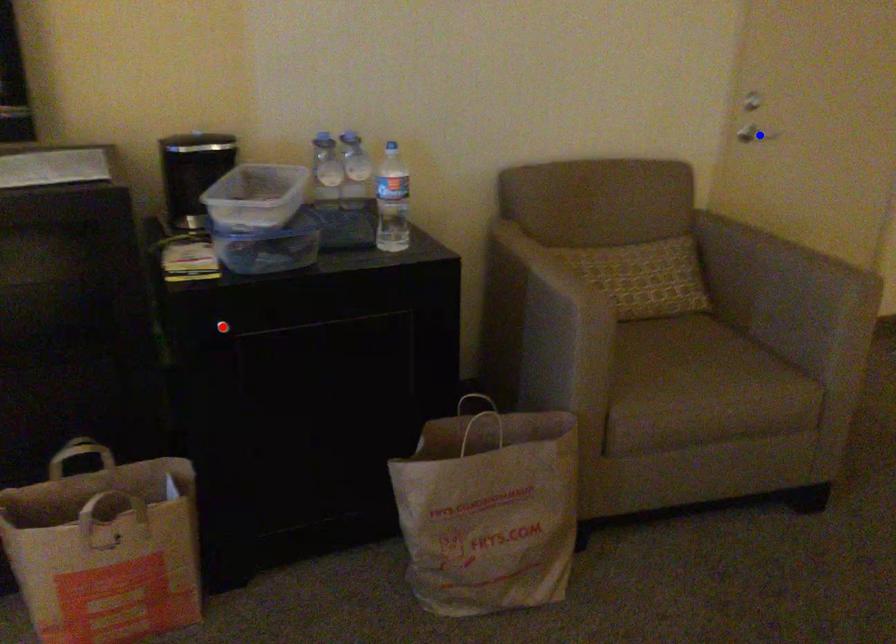
Question: In the image, two points are highlighted. Which point is nearer to the camera? Reply with the corresponding letter.

Choices:
 (A) blue point
 (B) red point

Answer: (B)